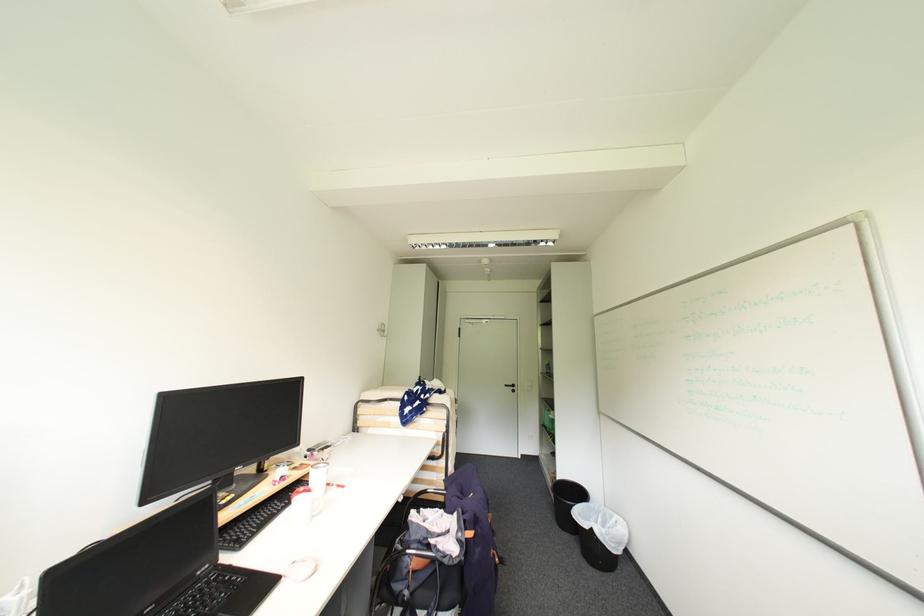
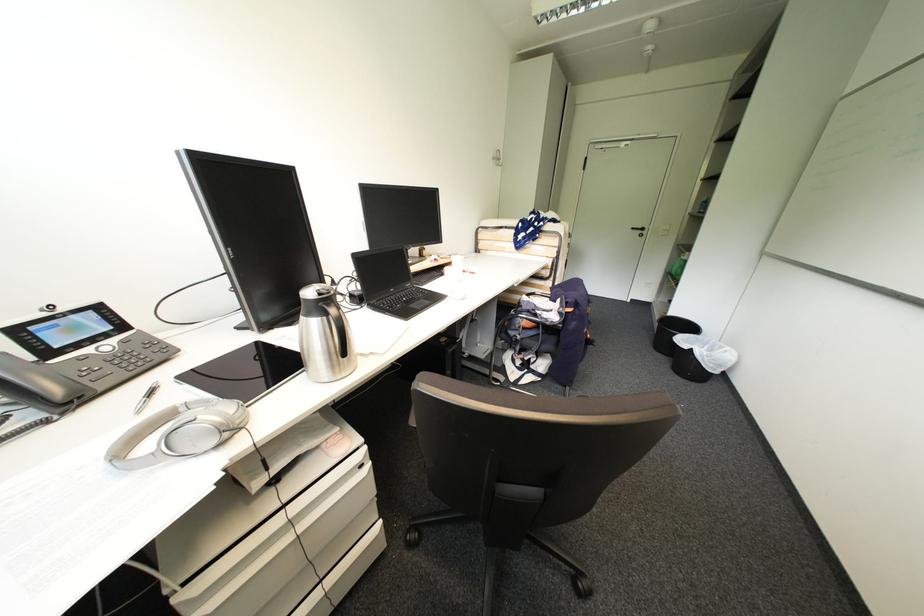
In the second image, find the point that corresponds to the point at 518,389 in the first image.

(648, 233)